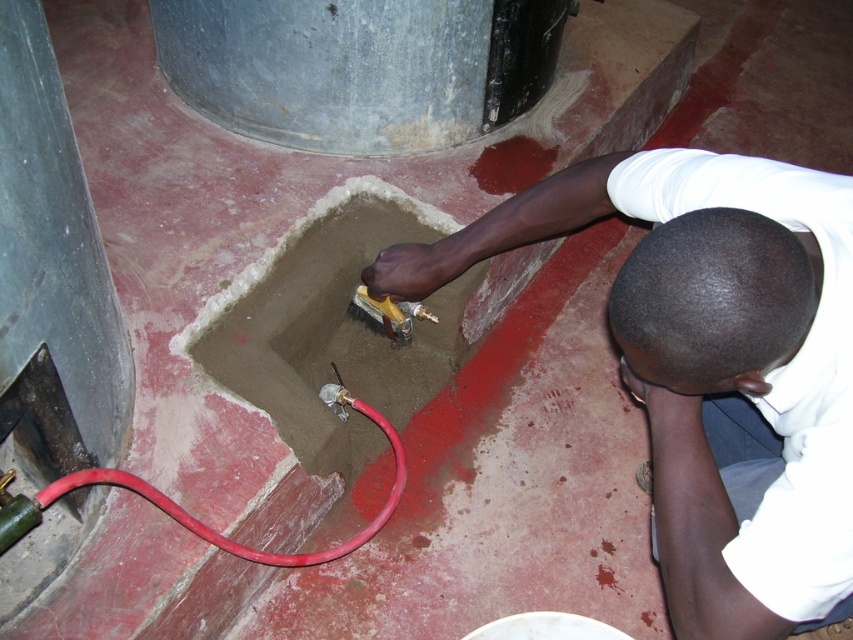
Can you confirm if smooth concrete basin at center is positioned above smooth concrete hole at center?

Incorrect, smooth concrete basin at center is not positioned above smooth concrete hole at center.

Is smooth concrete basin at center thinner than smooth concrete hole at center?

Incorrect, smooth concrete basin at center's width is not less than smooth concrete hole at center's.

Which is behind, point (838, 481) or point (259, 406)?

Point (259, 406)

What are the coordinates of `smooth concrete basin at center` in the screenshot? It's located at (711, 362).

Between smooth concrete hole at center and red rubber hose at lower left, which one appears on the left side from the viewer's perspective?

red rubber hose at lower left is more to the left.

Is smooth concrete hole at center positioned at the back of red rubber hose at lower left?

That is True.

Does point (276, 419) lie behind point (3, 552)?

Yes, it is.

This screenshot has width=853, height=640. In order to click on smooth concrete hole at center in this screenshot , I will do point(332,330).

Which is below, smooth concrete basin at center or red rubber hose at lower left?

red rubber hose at lower left is below.

Who is higher up, smooth concrete basin at center or red rubber hose at lower left?

smooth concrete basin at center is higher up.

This screenshot has height=640, width=853. What do you see at coordinates (711, 362) in the screenshot? I see `smooth concrete basin at center` at bounding box center [711, 362].

Image resolution: width=853 pixels, height=640 pixels. I want to click on smooth concrete basin at center, so [x=711, y=362].